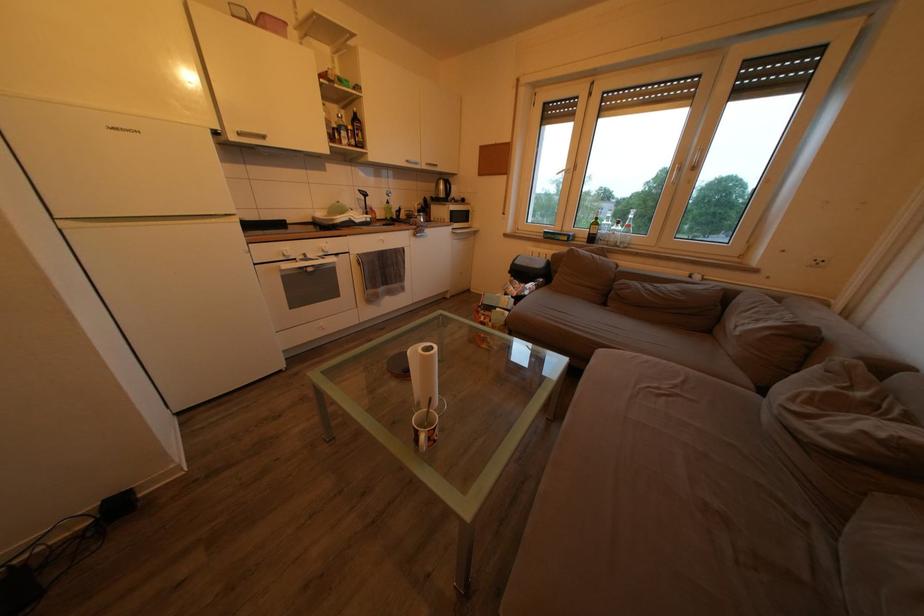
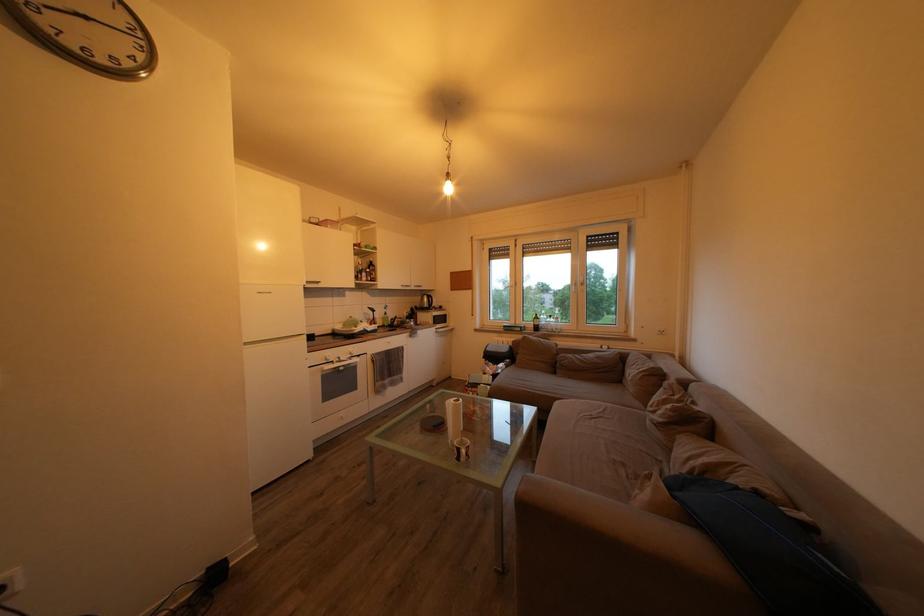
In the second image, find the point that corresponds to the point at 423,438 in the first image.

(467, 456)